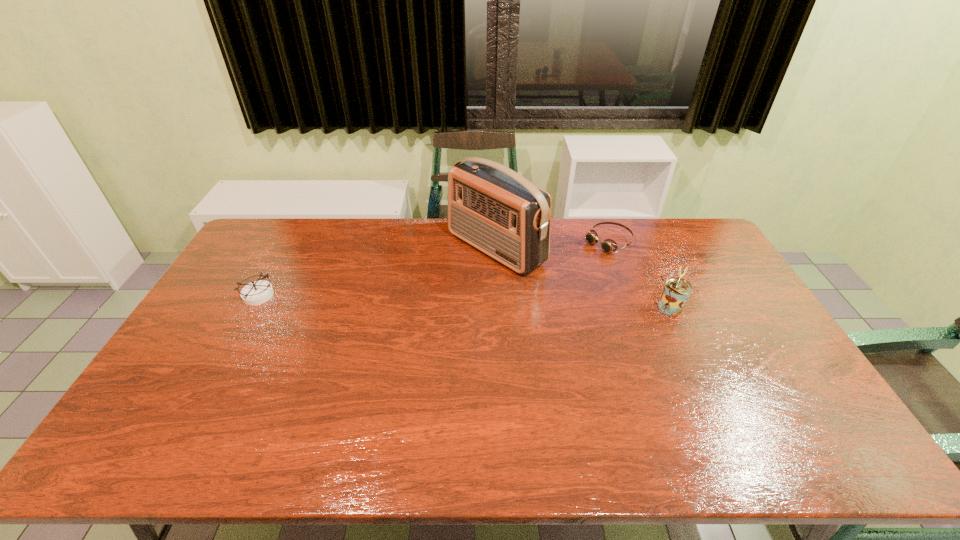
Where is `vacant position at the right edge of the desktop`? This screenshot has width=960, height=540. vacant position at the right edge of the desktop is located at coordinates (739, 289).

You are a GUI agent. You are given a task and a screenshot of the screen. Output one action in this format:
    pyautogui.click(x=<x>, y=<y>)
    Task: Click on the free space at the far right corner
    
    Given the screenshot: What is the action you would take?
    pyautogui.click(x=677, y=226)

Find the location of a particular element. free space between the shortest object and the leftmost object is located at coordinates click(x=433, y=269).

This screenshot has height=540, width=960. Identify the location of vacant area that lies between the second tallest object and the radio receiver. (x=584, y=278).

This screenshot has height=540, width=960. I want to click on free spot between the radio receiver and the second tallest object, so click(584, 278).

I want to click on free space between the third tallest object and the goggles, so click(433, 269).

In order to click on free spot between the goggles and the tallest object in this screenshot , I will do `click(552, 245)`.

I want to click on empty space that is in between the leftmost object and the radio receiver, so click(x=377, y=272).

The width and height of the screenshot is (960, 540). Find the location of `free space between the goggles and the leftmost object`. free space between the goggles and the leftmost object is located at coordinates (433, 269).

I want to click on empty space that is in between the leftmost object and the tallest object, so click(x=377, y=272).